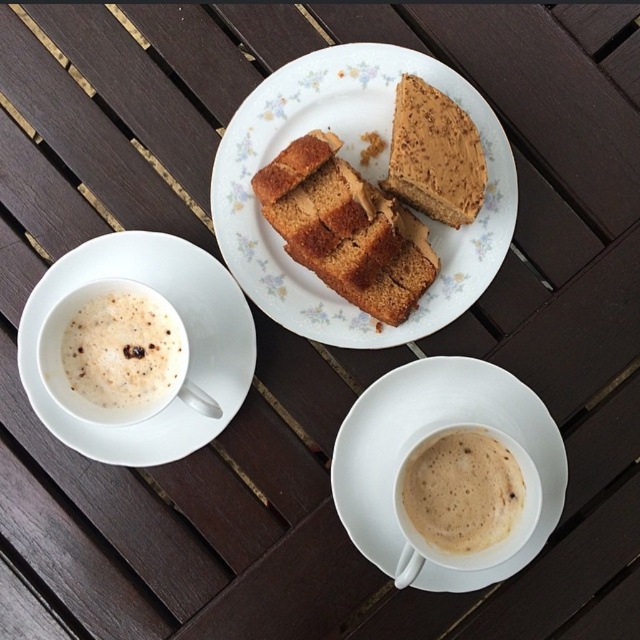
Question: Is white frothy coffee at upper left positioned in front of golden brown cake at center?

Choices:
 (A) no
 (B) yes

Answer: (B)

Question: Which of these objects is positioned closest to the golden-brown cake at center?

Choices:
 (A) white ceramic saucer at center
 (B) foamy white coffee at lower center

Answer: (A)

Question: Is white ceramic saucer at center to the right of golden brown cake at center from the viewer's perspective?

Choices:
 (A) yes
 (B) no

Answer: (A)

Question: Which point is closer to the camera?

Choices:
 (A) (189, 285)
 (B) (436, 154)
 (C) (360, 465)

Answer: (B)

Question: Does white ceramic saucer at center have a greater width compared to foamy white coffee at lower center?

Choices:
 (A) no
 (B) yes

Answer: (B)

Question: Which of the following is the closest to the observer?

Choices:
 (A) (115, 403)
 (B) (45, 275)

Answer: (A)